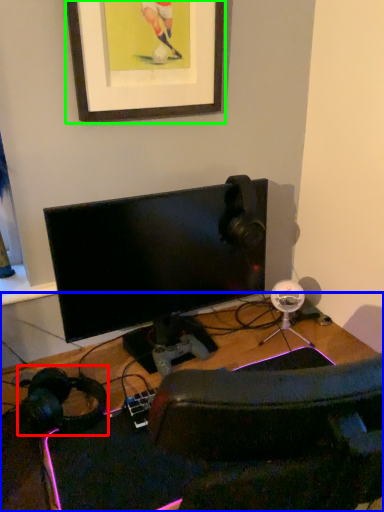
Question: Which is nearer to the headphones (highlighted by a red box)? desk (highlighted by a blue box) or picture frame (highlighted by a green box).

Choices:
 (A) desk
 (B) picture frame

Answer: (A)